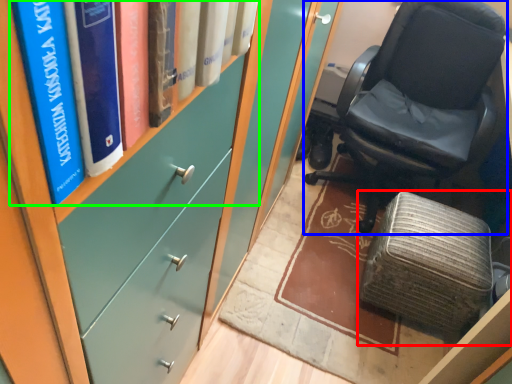
Question: Estimate the real-world distances between objects in this image. Which object is closer to furniture (highlighted by a red box), chair (highlighted by a blue box) or book (highlighted by a green box)?

Choices:
 (A) chair
 (B) book

Answer: (A)